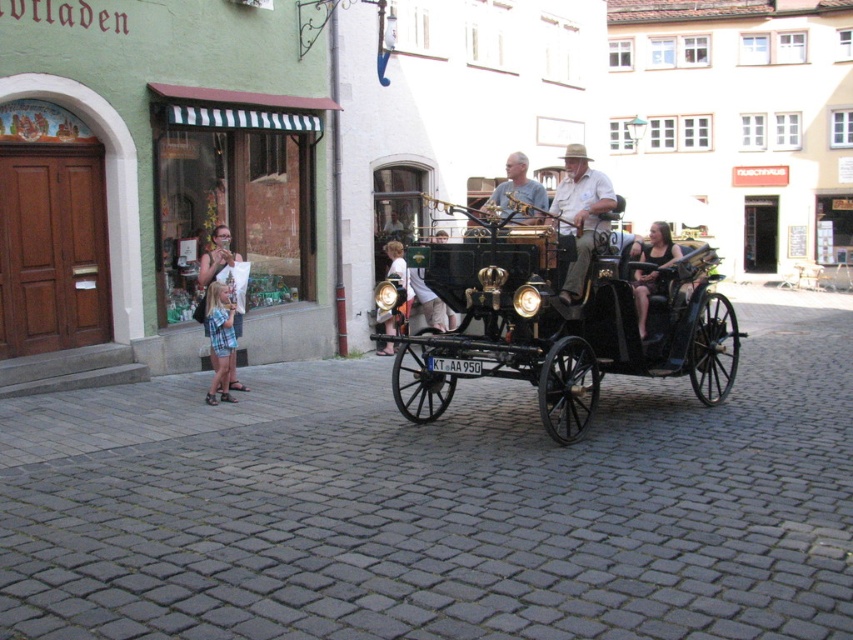
Question: Which object is farther from the camera taking this photo?

Choices:
 (A) dark brown leather jacket at center
 (B) plaid shorts at left
 (C) light beige fabric hat at center

Answer: (B)

Question: Is the position of blue plaid shorts at center more distant than that of plaid shorts at left?

Choices:
 (A) no
 (B) yes

Answer: (A)

Question: Which object is closer to the camera taking this photo?

Choices:
 (A) polished wood horse cart at center
 (B) blue plaid shorts at center
 (C) dark brown leather jacket at center
 (D) light beige fabric hat at center

Answer: (D)

Question: Does blue plaid shorts at center appear on the right side of dark brown leather jacket at center?

Choices:
 (A) yes
 (B) no

Answer: (B)

Question: Which is nearer to the plaid shorts at left?

Choices:
 (A) blue plaid shorts at center
 (B) polished wood horse cart at center

Answer: (A)

Question: Is polished wood horse cart at center thinner than light beige fabric hat at center?

Choices:
 (A) yes
 (B) no

Answer: (B)